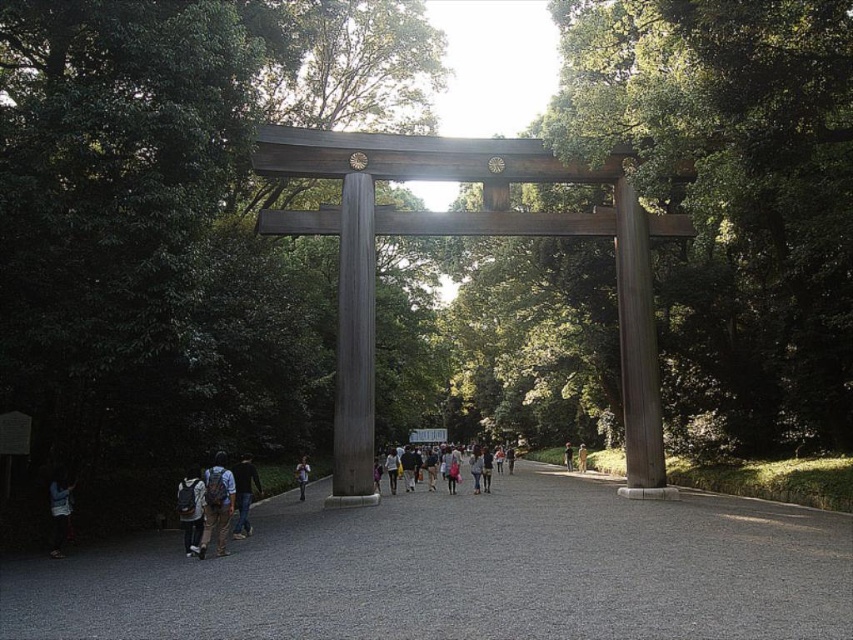
You are standing in front of the torii gate and notice two jackets hanging nearby. Which jacket is shorter in height between the light blue denim jacket at lower left and the brown leather jacket at center?

The light blue denim jacket at lower left is shorter in height compared to the brown leather jacket at center.